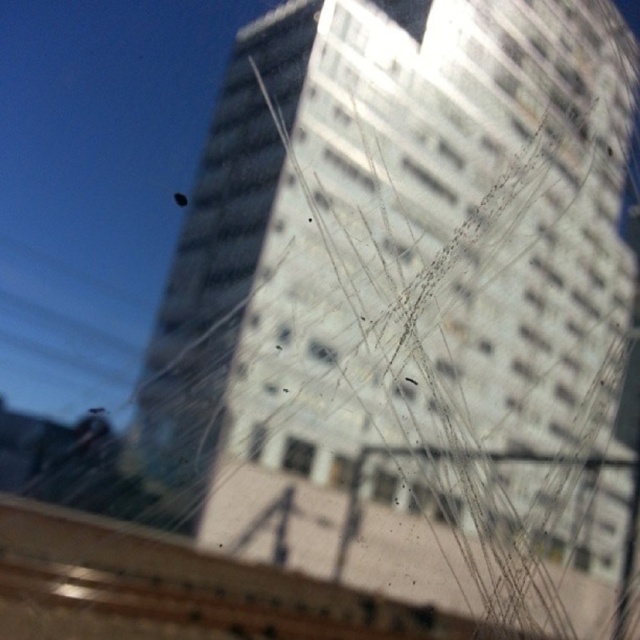
Which is below, clear glass window at center or transparent glass window at center?

Positioned lower is transparent glass window at center.

Who is positioned more to the left, clear glass window at center or transparent glass window at center?

clear glass window at center is more to the left.

Which is behind, point (301, 470) or point (387, 486)?

The point (387, 486) is more distant.

Where is `clear glass window at center`? This screenshot has height=640, width=640. clear glass window at center is located at coordinates (298, 456).